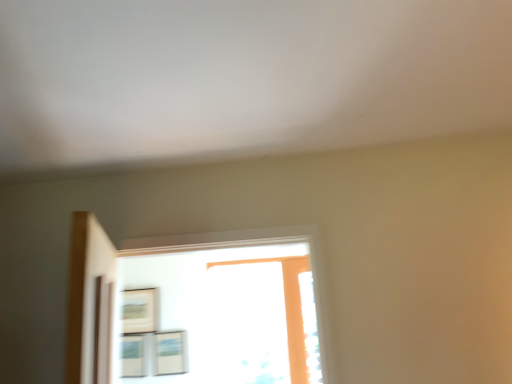
Question: Relative to matte black picture frame at upper left, the first picture frame when ordered from left to right, is matte white picture frame at lower left, arranged as the 2th picture frame when viewed from the right, in front or behind?

Choices:
 (A) behind
 (B) front

Answer: (B)

Question: From the image's perspective, relative to matte black picture frame at upper left, arranged as the third picture frame when viewed from the right, is matte white picture frame at lower left, arranged as the 2th picture frame when viewed from the right, above or below?

Choices:
 (A) above
 (B) below

Answer: (B)

Question: Which object is positioned closest to the matte black picture frame at upper left, arranged as the third picture frame when viewed from the right?

Choices:
 (A) matte white picture frame at lower left, arranged as the 2th picture frame when viewed from the right
 (B) matte wooden picture frame at center, which ranks as the first picture frame in right-to-left order

Answer: (A)

Question: Which object is the closest to the matte black picture frame at upper left, arranged as the third picture frame when viewed from the right?

Choices:
 (A) matte wooden picture frame at center, which ranks as the first picture frame in right-to-left order
 (B) matte white picture frame at lower left, arranged as the 2th picture frame when viewed from the right

Answer: (B)